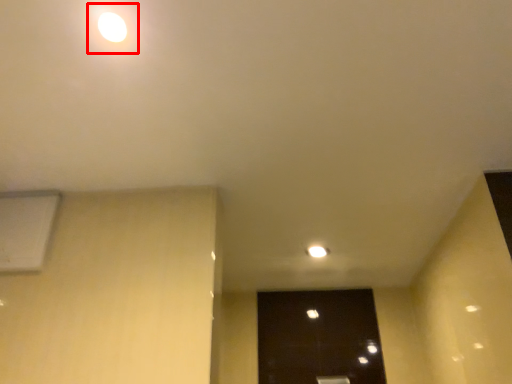
Question: From the image's perspective, considering the relative positions of light (annotated by the red box) and air conditioning in the image provided, where is light (annotated by the red box) located with respect to the staircase?

Choices:
 (A) above
 (B) below

Answer: (A)